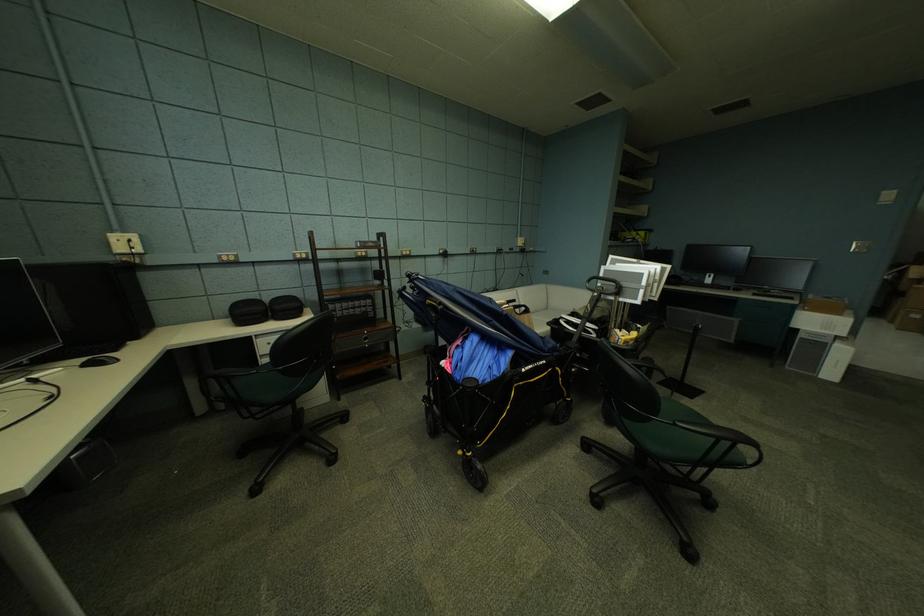
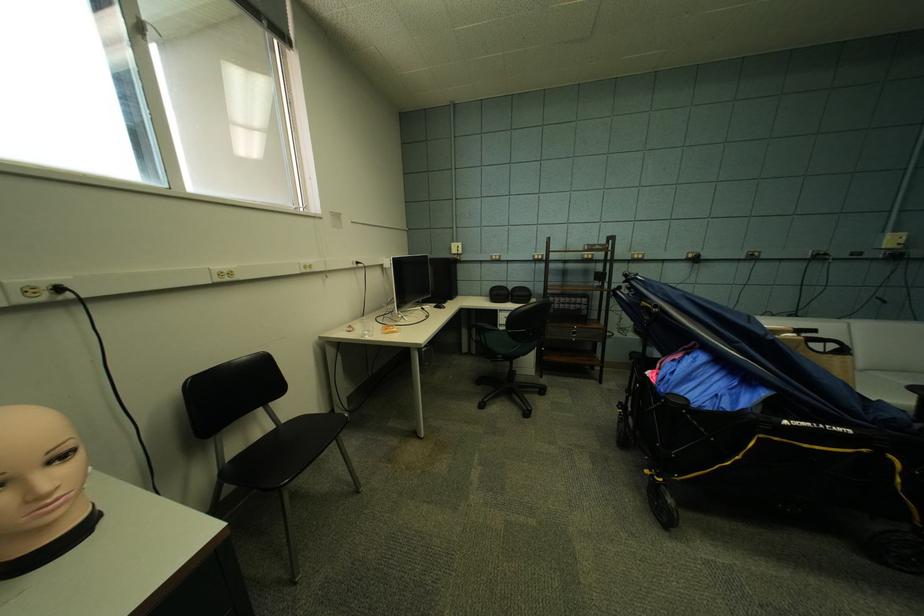
Find the pixel in the second image that matches pixel 379 245 in the first image.

(606, 248)